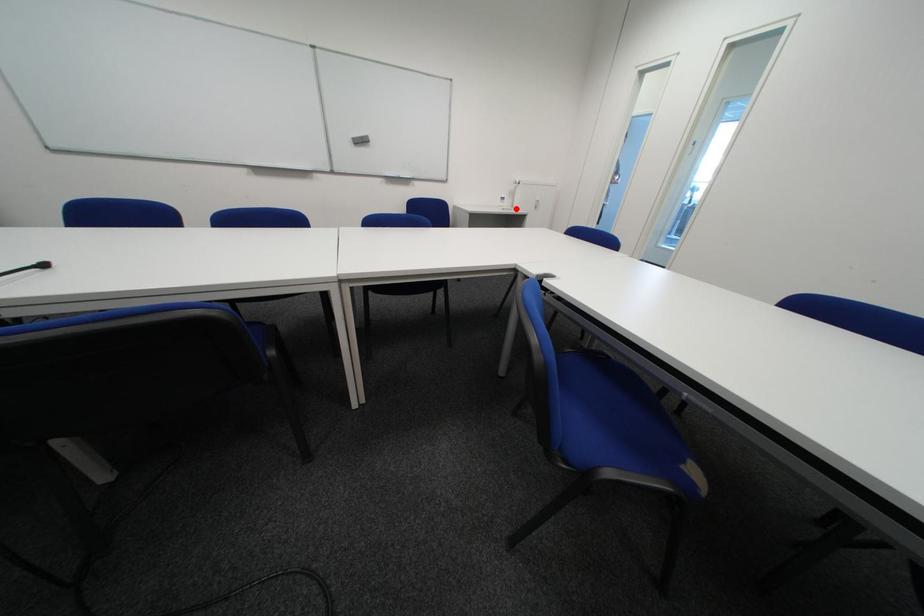
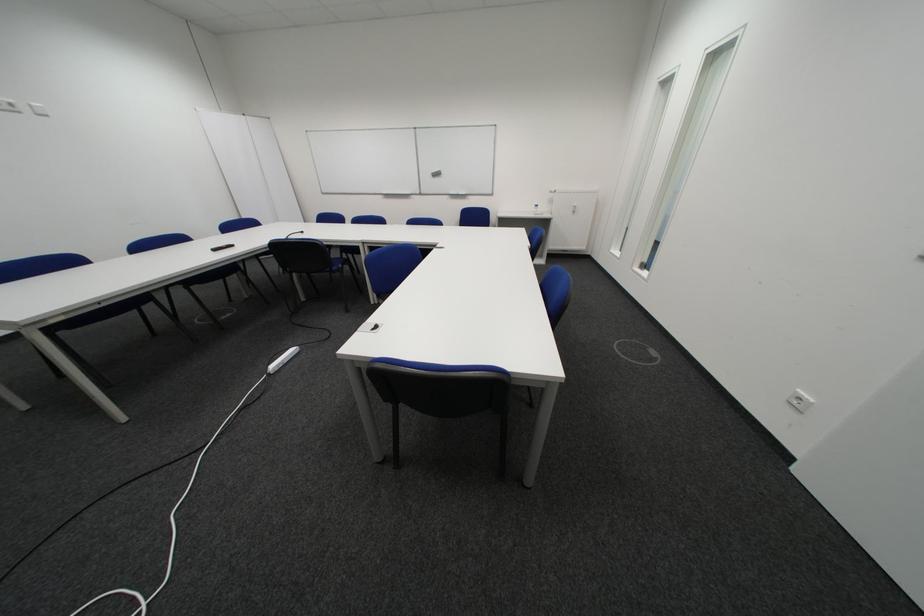
Where in the second image is the point corresponding to the highlighted location from the first image?

(548, 215)